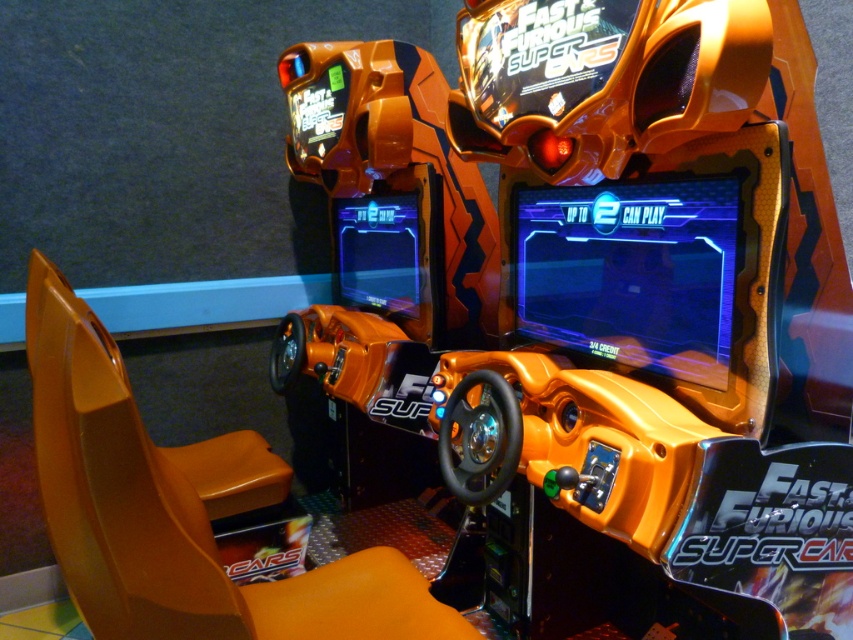
Can you confirm if orange matte/soft plastic arcade game at center is shorter than shiny orange arcade machine at center?

Incorrect, orange matte/soft plastic arcade game at center's height does not fall short of shiny orange arcade machine at center's.

Where is `orange matte/soft plastic arcade game at center`? This screenshot has height=640, width=853. orange matte/soft plastic arcade game at center is located at coordinates (596, 288).